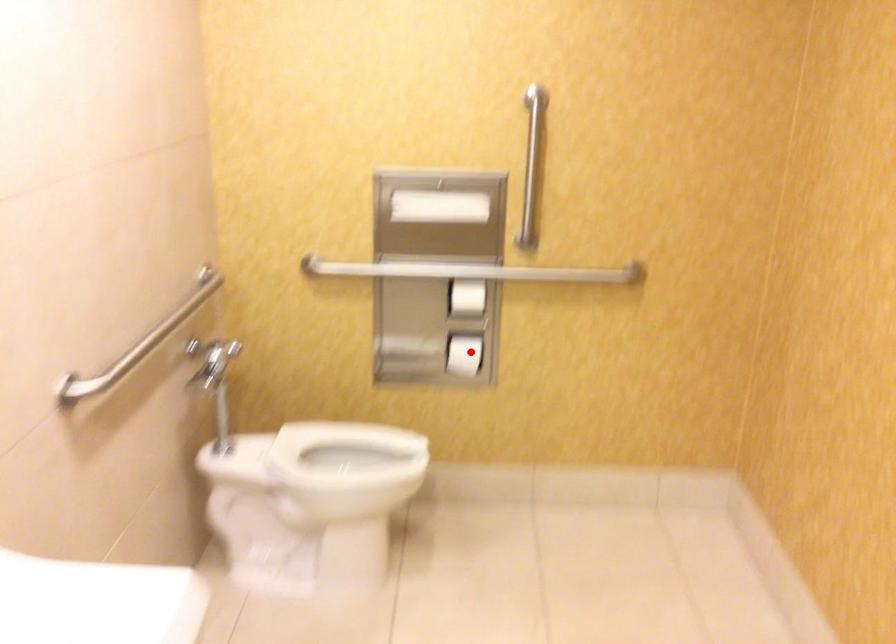
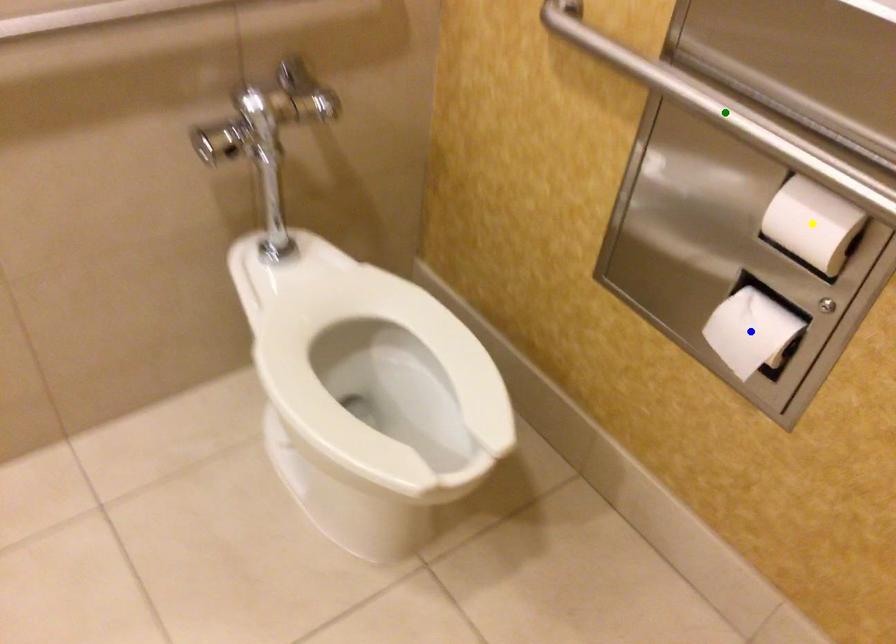
Question: I am providing you with two images of the same scene from different viewpoints. A red point is marked on the first image. You are given multiple points on the second image. Which point in image 2 is actually the same real-world point as the red point in image 1?

Choices:
 (A) yellow point
 (B) green point
 (C) blue point

Answer: (C)